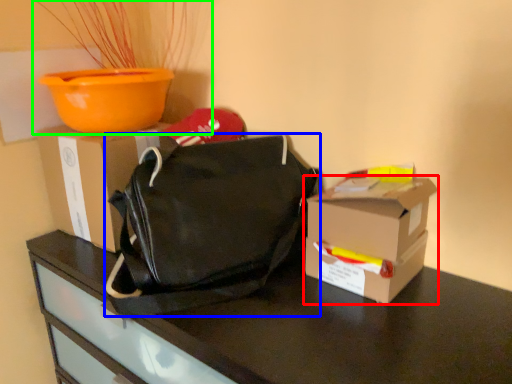
Question: Estimate the real-world distances between objects in this image. Which object is farther from box (highlighted by a red box), handbag (highlighted by a blue box) or houseplant (highlighted by a green box)?

Choices:
 (A) handbag
 (B) houseplant

Answer: (B)